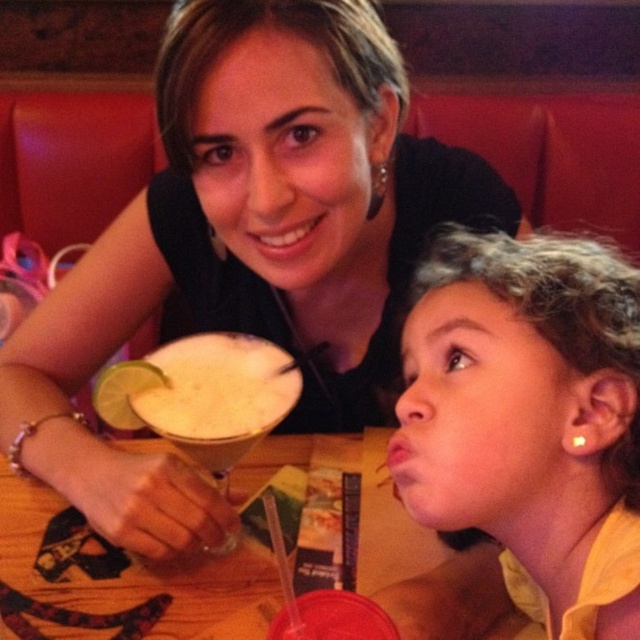
You are a photographer setting up a camera at position point 0.5, 0.5. You need to capture a clear shot of the matte black dress at center. Is the dress within the camera frame?

The matte black dress at center is located at point (248, 246), which is within the camera frame centered at (320, 320). Therefore, the dress is within the camera frame.

Looking at this image, what is located at the coordinates point (522, 397)?

The matte yellow shirt at center is located at point (522, 397).